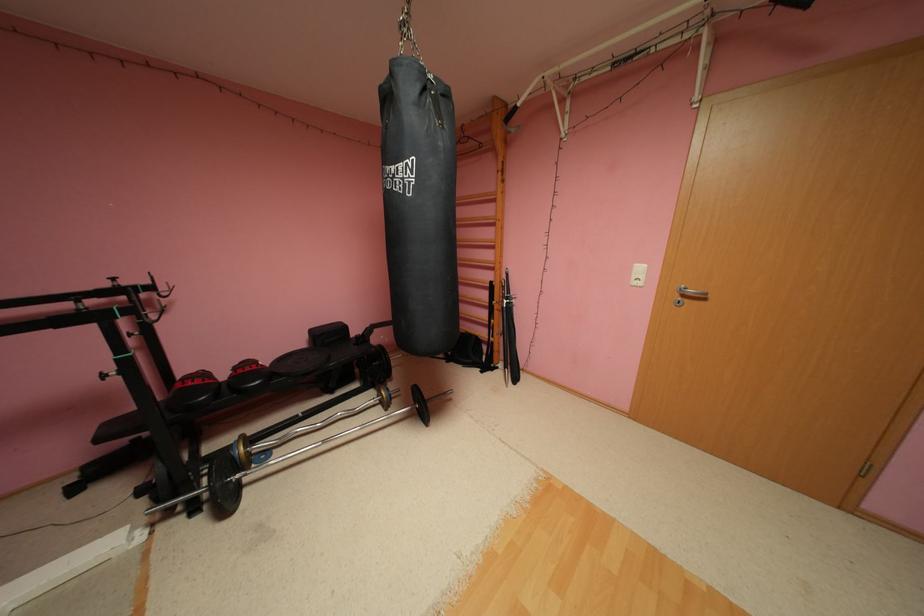
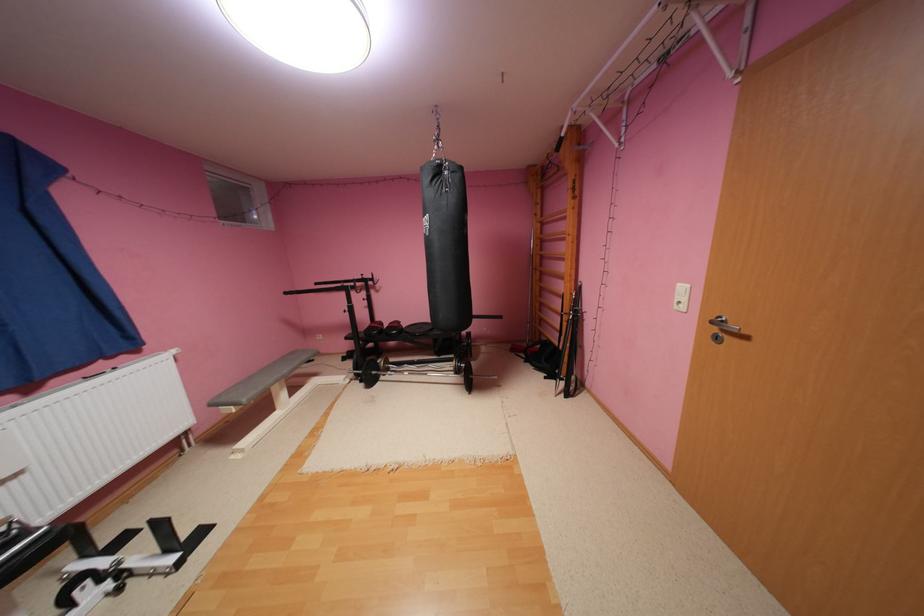
The point at (491, 371) is marked in the first image. Where is the corresponding point in the second image?

(554, 378)